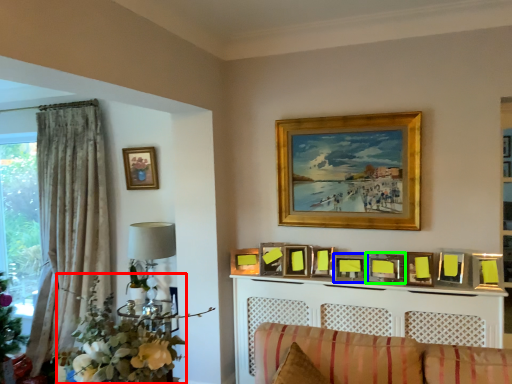
Question: Which is nearer to the floral arrangement (highlighted by a red box)? picture frame (highlighted by a blue box) or picture frame (highlighted by a green box).

Choices:
 (A) picture frame
 (B) picture frame

Answer: (A)